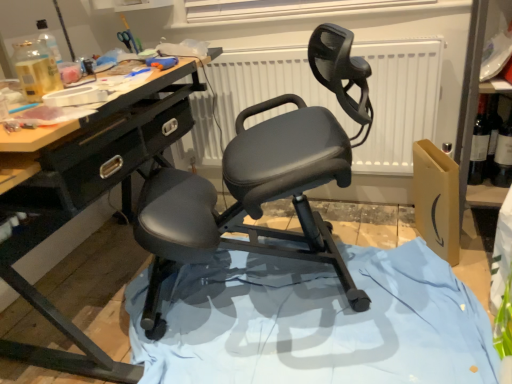
Question: Does white matte radiator at center have a greater width compared to blue fabric at center?

Choices:
 (A) yes
 (B) no

Answer: (B)

Question: Is blue fabric at center a part of white matte radiator at center?

Choices:
 (A) yes
 (B) no

Answer: (B)

Question: Is white matte radiator at center further to the viewer compared to blue fabric at center?

Choices:
 (A) yes
 (B) no

Answer: (A)

Question: Is white matte radiator at center smaller than blue fabric at center?

Choices:
 (A) yes
 (B) no

Answer: (A)

Question: Considering the relative sizes of white matte radiator at center and blue fabric at center in the image provided, is white matte radiator at center bigger than blue fabric at center?

Choices:
 (A) yes
 (B) no

Answer: (B)

Question: Could you tell me if white matte radiator at center is facing blue fabric at center?

Choices:
 (A) no
 (B) yes

Answer: (B)

Question: Can you confirm if white matte radiator at center is bigger than white matte window screen at upper center?

Choices:
 (A) no
 (B) yes

Answer: (B)

Question: Is white matte window screen at upper center completely or partially inside white matte radiator at center?

Choices:
 (A) yes
 (B) no

Answer: (B)

Question: Does white matte radiator at center have a greater width compared to white matte window screen at upper center?

Choices:
 (A) no
 (B) yes

Answer: (B)

Question: Is white matte radiator at center turned away from white matte window screen at upper center?

Choices:
 (A) no
 (B) yes

Answer: (A)

Question: Is white matte radiator at center at the left side of white matte window screen at upper center?

Choices:
 (A) yes
 (B) no

Answer: (B)

Question: From the image's perspective, is white matte radiator at center over white matte window screen at upper center?

Choices:
 (A) no
 (B) yes

Answer: (A)

Question: From the image's perspective, is matte black ergonomic chair at center over blue fabric at center?

Choices:
 (A) yes
 (B) no

Answer: (A)